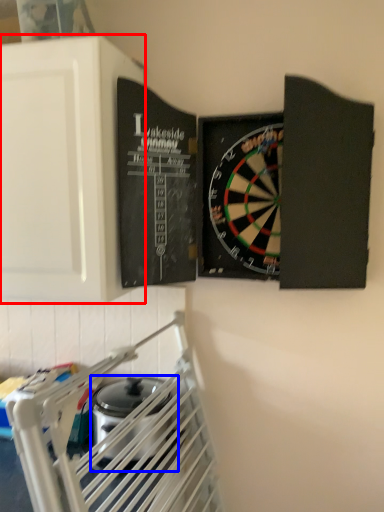
Question: Among these objects, which one is farthest to the camera, cabinetry (highlighted by a red box) or appliance (highlighted by a blue box)?

Choices:
 (A) cabinetry
 (B) appliance

Answer: (B)